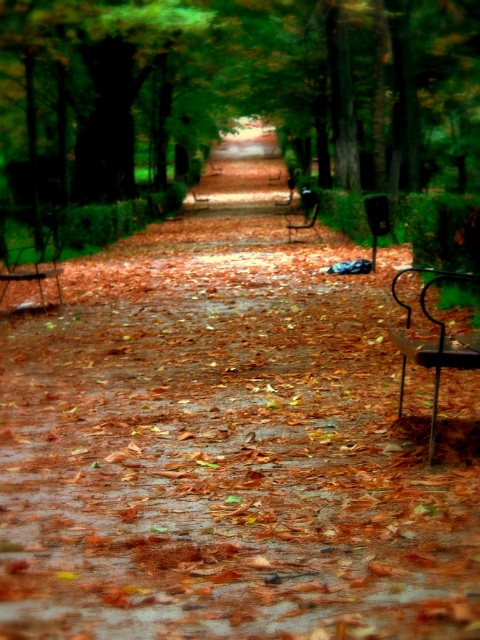
You are a park visitor who wants to sit on the benches. The wooden bench at left is below the metallic silver bench at center. Which bench is closer to the ground?

The wooden bench at left is located below the metallic silver bench at center, so it is closer to the ground.

You are standing at the starting point of the path in the park. You see two points marked on the path ahead of you. One is at point (439, 340) and the other is at point (319, 234). Which point will you reach first as you walk along the path?

Point (439, 340) is in front of point (319, 234), so you will reach point (439, 340) first as you walk along the path.